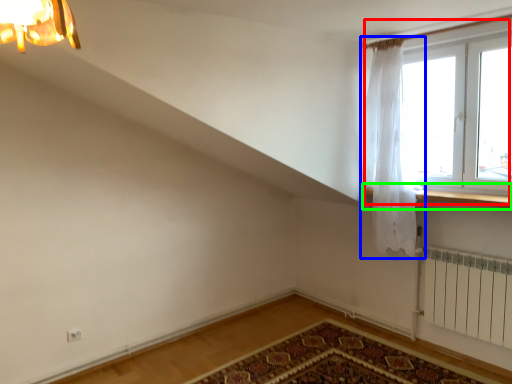
Question: Based on their relative distances, which object is nearer to window (highlighted by a red box)? Choose from curtain (highlighted by a blue box) and window sill (highlighted by a green box).

Choices:
 (A) curtain
 (B) window sill

Answer: (A)